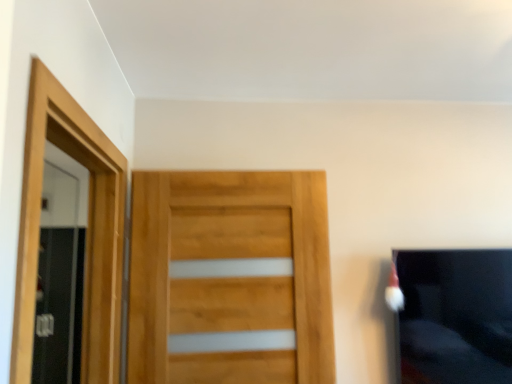
Question: Does wooden screen door at left, which is the 1th screen door in back-to-front order, lie in front of natural wood door at center?

Choices:
 (A) no
 (B) yes

Answer: (A)

Question: Can we say wooden screen door at left, the first screen door in the left-to-right sequence, lies outside natural wood door at center?

Choices:
 (A) no
 (B) yes

Answer: (B)

Question: From a real-world perspective, is wooden screen door at left, the 2th screen door when ordered from right to left, located higher than natural wood door at center?

Choices:
 (A) no
 (B) yes

Answer: (A)

Question: Can you confirm if wooden screen door at left, which is the 2th screen door in front-to-back order, is wider than natural wood door at center?

Choices:
 (A) yes
 (B) no

Answer: (A)

Question: Does wooden screen door at left, which is the 2th screen door in front-to-back order, have a greater height compared to natural wood door at center?

Choices:
 (A) no
 (B) yes

Answer: (B)

Question: Is wooden screen door at left, the first screen door in the left-to-right sequence, shorter than natural wood door at center?

Choices:
 (A) no
 (B) yes

Answer: (A)

Question: From a real-world perspective, is black fabric couch at right over wooden screen door at left, which is the 1th screen door in back-to-front order?

Choices:
 (A) yes
 (B) no

Answer: (B)

Question: From the image's perspective, is black fabric couch at right below wooden screen door at left, which is the 2th screen door in front-to-back order?

Choices:
 (A) yes
 (B) no

Answer: (B)

Question: Is there a large distance between black fabric couch at right and wooden screen door at left, which is the 1th screen door in back-to-front order?

Choices:
 (A) yes
 (B) no

Answer: (A)

Question: Is black fabric couch at right positioned before wooden screen door at left, the 2th screen door when ordered from right to left?

Choices:
 (A) no
 (B) yes

Answer: (B)

Question: Does black fabric couch at right appear on the left side of wooden screen door at left, which is the 2th screen door in front-to-back order?

Choices:
 (A) yes
 (B) no

Answer: (B)

Question: Is black fabric couch at right surrounding wooden screen door at left, which is the 1th screen door in back-to-front order?

Choices:
 (A) yes
 (B) no

Answer: (B)

Question: Considering the relative sizes of black fabric couch at right and natural wood door at center in the image provided, is black fabric couch at right thinner than natural wood door at center?

Choices:
 (A) yes
 (B) no

Answer: (B)